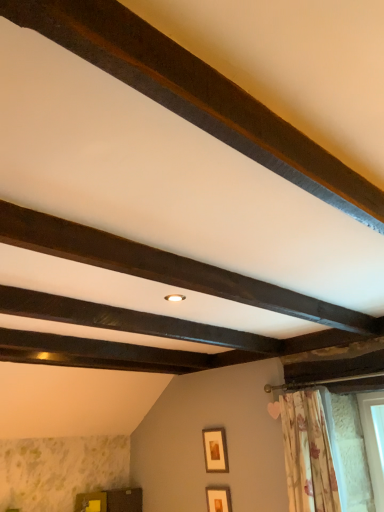
Question: From the image's perspective, would you say wooden picture frame at center, the first picture frame when ordered from top to bottom, is positioned over floral fabric curtain at lower right?

Choices:
 (A) no
 (B) yes

Answer: (A)

Question: Considering the relative sizes of wooden picture frame at center, the first picture frame when ordered from top to bottom, and floral fabric curtain at lower right in the image provided, is wooden picture frame at center, the first picture frame when ordered from top to bottom, smaller than floral fabric curtain at lower right?

Choices:
 (A) no
 (B) yes

Answer: (B)

Question: Is wooden picture frame at center, arranged as the second picture frame when ordered from the bottom, surrounding floral fabric curtain at lower right?

Choices:
 (A) no
 (B) yes

Answer: (A)

Question: Does wooden picture frame at center, arranged as the second picture frame when ordered from the bottom, have a larger size compared to floral fabric curtain at lower right?

Choices:
 (A) no
 (B) yes

Answer: (A)

Question: Can you confirm if wooden picture frame at center, the first picture frame when ordered from top to bottom, is taller than floral fabric curtain at lower right?

Choices:
 (A) no
 (B) yes

Answer: (A)

Question: From the image's perspective, is floral fabric curtain at lower right located above or below matte gold picture frame at lower center, which is the first picture frame in bottom-to-top order?

Choices:
 (A) above
 (B) below

Answer: (A)

Question: Is point (296, 409) closer or farther from the camera than point (208, 494)?

Choices:
 (A) farther
 (B) closer

Answer: (B)

Question: Considering the relative positions of floral fabric curtain at lower right and matte gold picture frame at lower center, which is the first picture frame in bottom-to-top order, in the image provided, is floral fabric curtain at lower right to the left or to the right of matte gold picture frame at lower center, which is the first picture frame in bottom-to-top order,?

Choices:
 (A) left
 (B) right

Answer: (B)

Question: In terms of size, does floral fabric curtain at lower right appear bigger or smaller than matte gold picture frame at lower center, arranged as the second picture frame when viewed from the top?

Choices:
 (A) small
 (B) big

Answer: (B)

Question: Looking at the image, does wooden cabinet at lower left seem bigger or smaller compared to matte gold picture frame at lower center, arranged as the second picture frame when viewed from the top?

Choices:
 (A) small
 (B) big

Answer: (B)

Question: From a real-world perspective, relative to matte gold picture frame at lower center, which is the first picture frame in bottom-to-top order, is wooden cabinet at lower left vertically above or below?

Choices:
 (A) below
 (B) above

Answer: (B)

Question: Based on their positions, is wooden cabinet at lower left located to the left or right of matte gold picture frame at lower center, arranged as the second picture frame when viewed from the top?

Choices:
 (A) right
 (B) left

Answer: (B)

Question: Relative to matte gold picture frame at lower center, which is the first picture frame in bottom-to-top order, is wooden cabinet at lower left in front or behind?

Choices:
 (A) front
 (B) behind

Answer: (B)

Question: Is dark wood beam at center, which is the 2th plank from front to back, situated inside floral fabric curtain at lower right or outside?

Choices:
 (A) outside
 (B) inside

Answer: (A)

Question: Considering the positions of point (155, 272) and point (327, 465), is point (155, 272) closer or farther from the camera than point (327, 465)?

Choices:
 (A) closer
 (B) farther

Answer: (A)